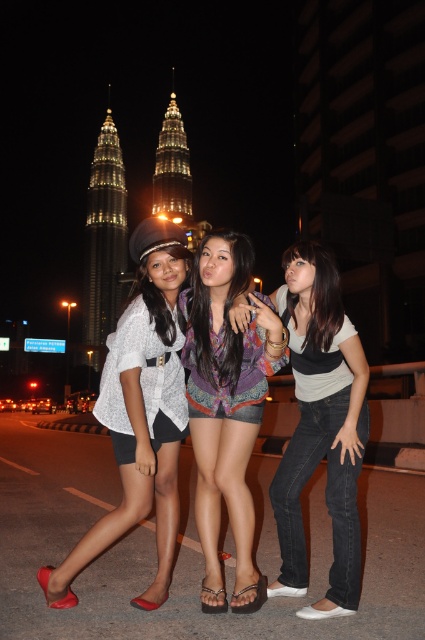
You are a photographer trying to capture a group photo of the three women in front of the Petronas Twin Towers. Based on the scene description, which object is wider between the matte white blouse at left and the denim jeans at center?

The matte white blouse at left is wider than the denim jeans at center.

You are a photographer trying to capture a clear photo of the denim jeans at center and the multicolored woven shirt at center. Which clothing item should you focus on first if you want to ensure the larger one is in sharp focus?

The denim jeans at center is bigger than the multicolored woven shirt at center, so you should focus on the denim jeans at center first to ensure it is in sharp focus.

You are a photographer trying to capture the middle woman in the scene. Which item, the denim jeans at center or the multicolored woven shirt at center, should you focus on to ensure the middle woman is in focus?

The denim jeans at center is closer to the viewer than the multicolored woven shirt at center, so focusing on the denim jeans at center will ensure the middle woman is in focus.